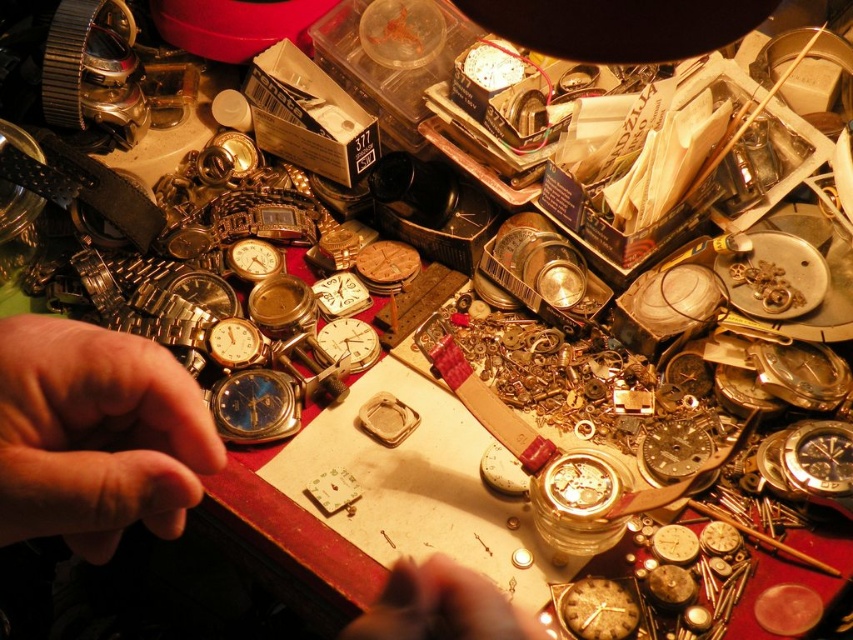
You are a watchmaker who needs to place a protective cover over the metallic watch at center. The cover requires a minimum distance of 18 inches from the watch to function properly. Can the cover be placed effectively?

The distance between the metallic watch at center and the camera is 19.13 inches, which exceeds the required 18 inches. Therefore, the protective cover can be placed effectively as it meets the distance requirement.

You are a watchmaker trying to locate two specific points on the cluttered workspace. The first point is labeled as point (x=62, y=401) and the second is point (x=619, y=605). Which point is nearer to your viewpoint?

Point (x=62, y=401) is closer to the camera than point (x=619, y=605), so the first point is nearer to your viewpoint.

You are a watchmaker who needs to place a new gear between the gold textured clock at center and another object. The gear requires a space of at least 3 feet. Is there enough space between them?

The gold textured clock at center and the other object are 3.67 feet apart, which is more than the required 3 feet. Therefore, there is enough space to place the gear between them.